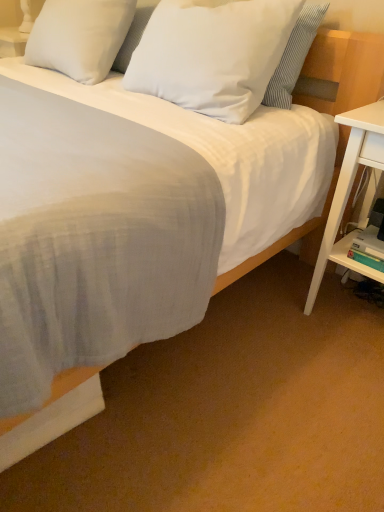
Find the location of a particular element. The height and width of the screenshot is (512, 384). free point to the left of white wood nightstand at right is located at coordinates (271, 317).